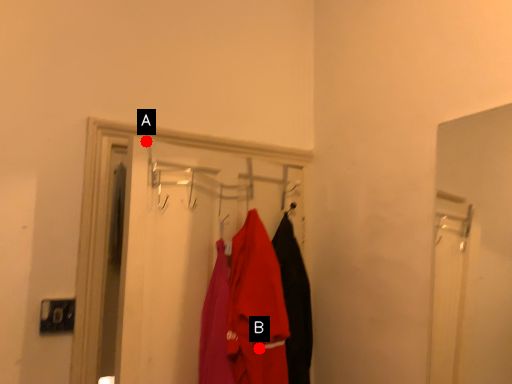
Question: Two points are circled on the image, labeled by A and B beside each circle. Which point appears farthest from the camera in this image?

Choices:
 (A) A is further
 (B) B is further

Answer: (B)